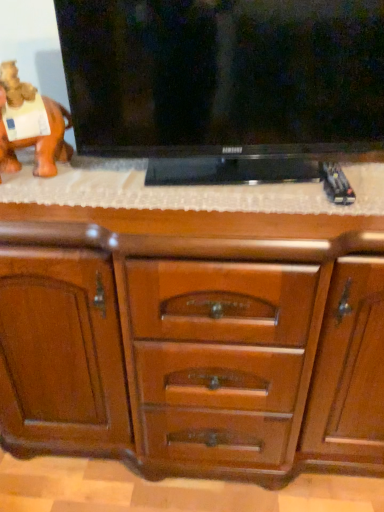
The image size is (384, 512). Identify the location of vacant area that lies between black glossy flat-screen tv at upper center and orange matte elephant at left. (52, 184).